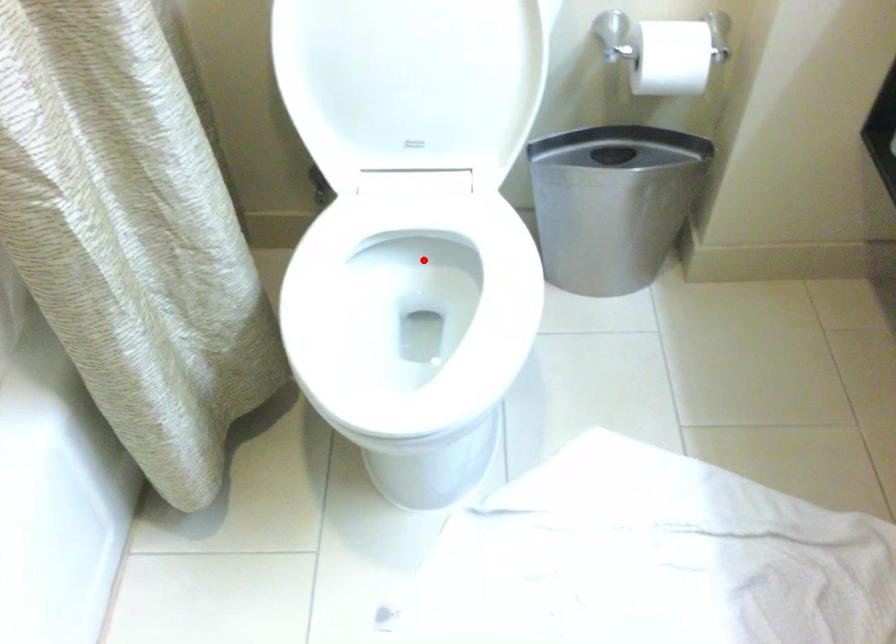
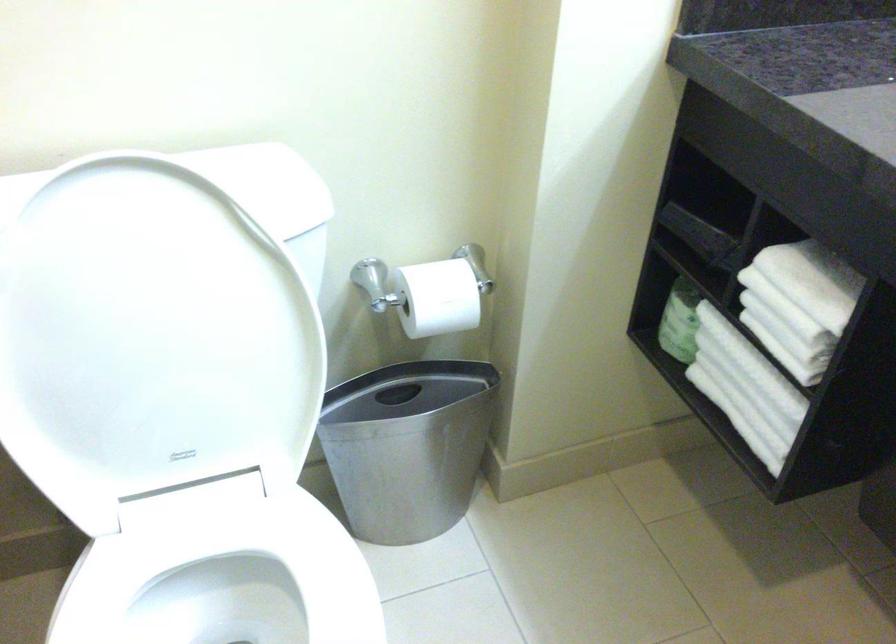
Question: A red point is marked in image1. In image2, is the corresponding 3D point closer to the camera or farther? Reply with the corresponding letter.

Choices:
 (A) The corresponding 3D point is closer.
 (B) The corresponding 3D point is farther.

Answer: (A)